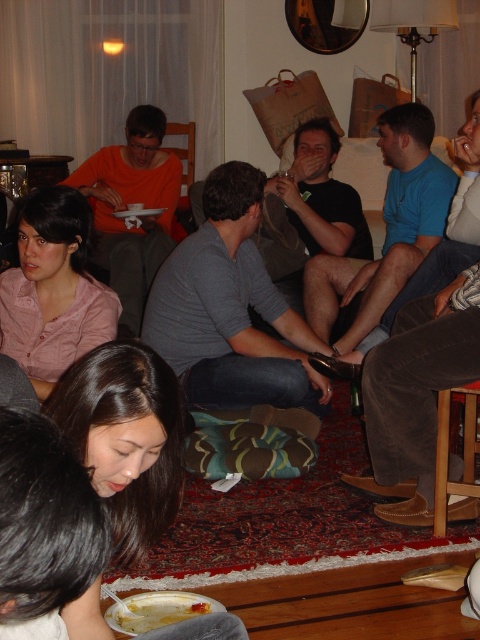
You are a guest at this gathering and want to place your blue corduroy pants at lower right and white plastic fork at lower center on the table. Which object should you move first to make space?

The blue corduroy pants at lower right is positioned on the right side of white plastic fork at lower center. To make space, you should move the white plastic fork at lower center first since it is to the left of the pants and moving it would allow more space for both items.